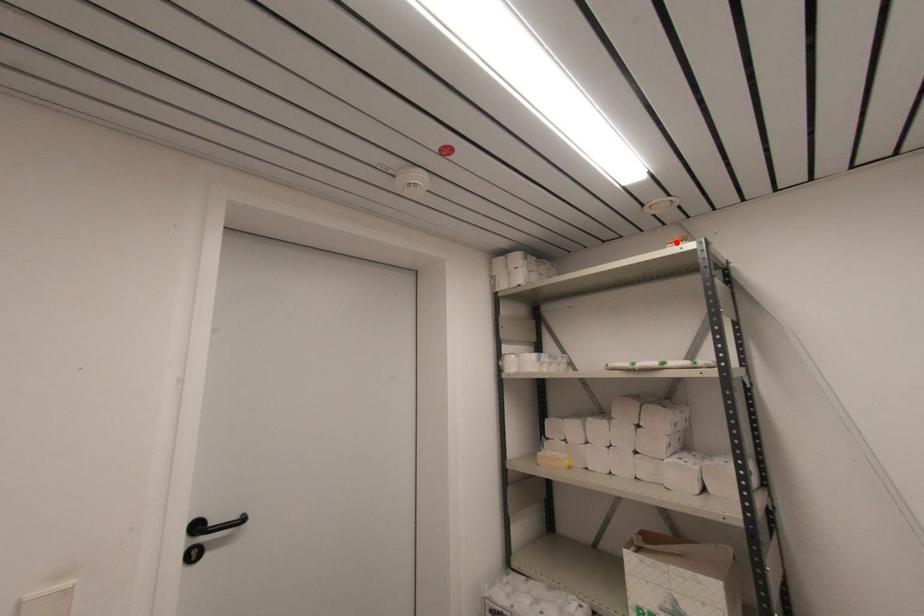
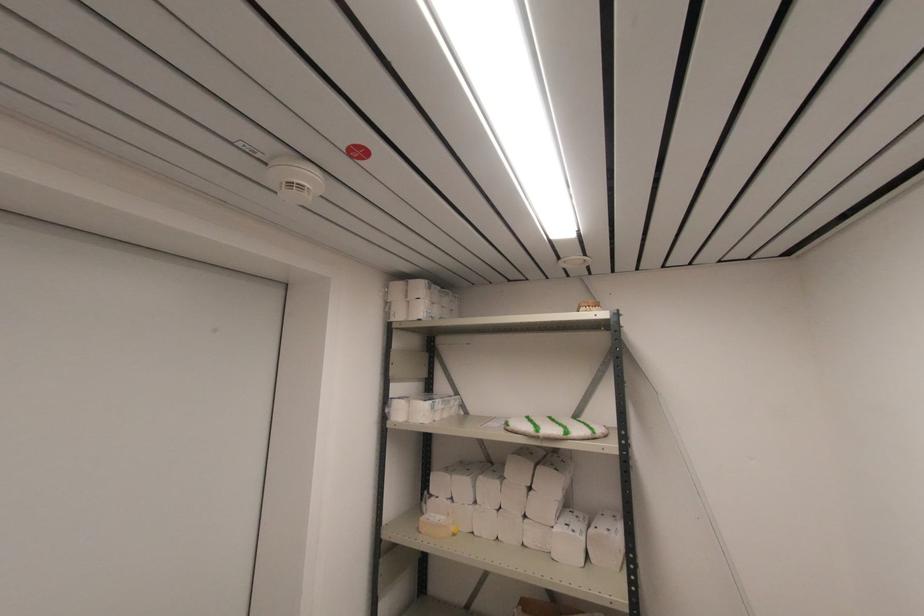
In the second image, find the point that corresponds to the highlighted location in the first image.

(590, 307)